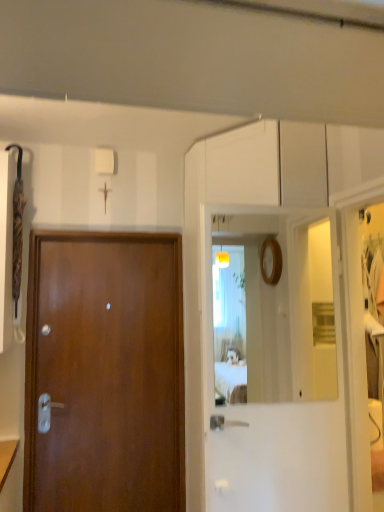
Question: Should I look upward or downward to see wooden door at left?

Choices:
 (A) up
 (B) down

Answer: (B)